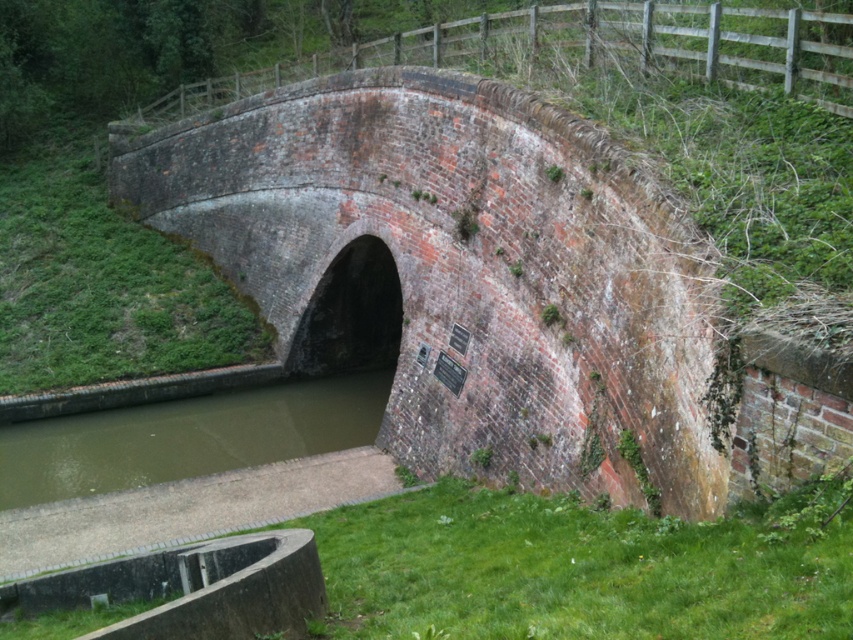
In the scene shown: Who is positioned more to the right, red brick tunnel at center or green murky water at lower left?

From the viewer's perspective, red brick tunnel at center appears more on the right side.

From the picture: Who is more distant from viewer, (132, 156) or (189, 470)?

The point (132, 156) is behind.

Find the location of a particular element. red brick tunnel at center is located at coordinates (457, 269).